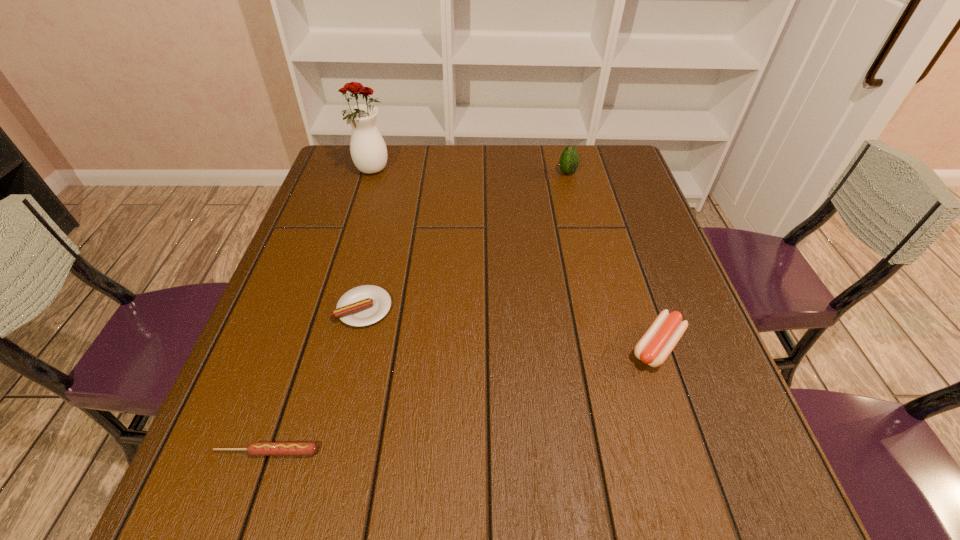
Where is `vase`? Image resolution: width=960 pixels, height=540 pixels. vase is located at coordinates (368, 150).

Locate an element on the screen. The width and height of the screenshot is (960, 540). avocado is located at coordinates (569, 161).

At what (x,y) coordinates should I click in order to perform the action: click on the fourth object from left to right. Please return your answer as a coordinate pair (x, y). This screenshot has height=540, width=960. Looking at the image, I should click on (569, 161).

I want to click on the tallest sausage, so click(657, 343).

The width and height of the screenshot is (960, 540). In order to click on the rightmost object in this screenshot , I will do `click(657, 343)`.

The width and height of the screenshot is (960, 540). In order to click on the second shortest object in this screenshot , I will do `click(364, 305)`.

Image resolution: width=960 pixels, height=540 pixels. What are the coordinates of `the shortest sausage` in the screenshot? It's located at (256, 448).

Locate an element on the screen. the nearest sausage is located at coordinates (256, 448).

Find the location of a particular element. Image resolution: width=960 pixels, height=540 pixels. vacant space located on the front of the tallest object is located at coordinates (346, 259).

Locate an element on the screen. The width and height of the screenshot is (960, 540). free region located on the back of the avocado is located at coordinates (564, 157).